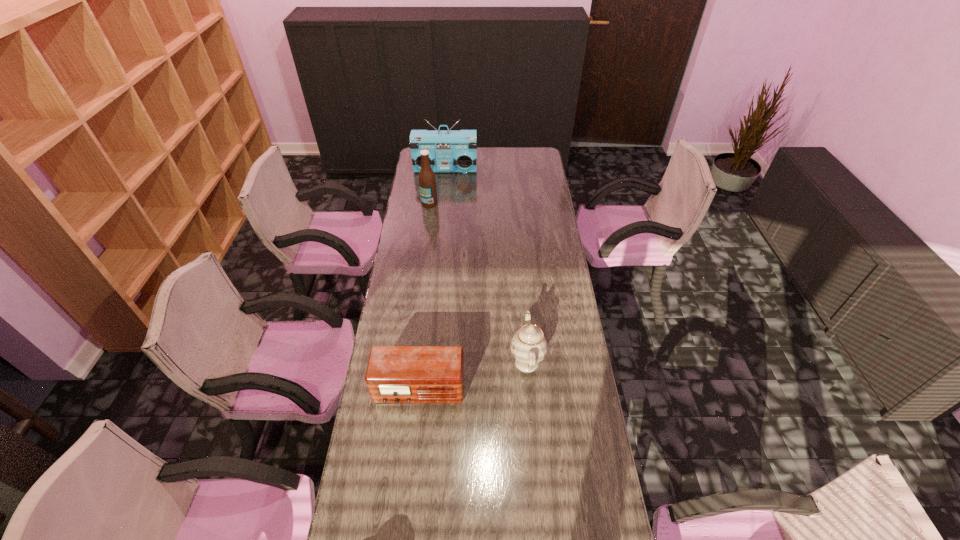
Identify the location of free space located on the spout of the chinaware. (438, 362).

Image resolution: width=960 pixels, height=540 pixels. Identify the location of free region located 0.180m on the spout of the chinaware. (460, 362).

You are a GUI agent. You are given a task and a screenshot of the screen. Output one action in this format:
    pyautogui.click(x=<x>, y=<y>)
    Task: Click on the vacant space located 0.350m on the front-facing side of the shorter radio receiver
    
    Given the screenshot: What is the action you would take?
    pyautogui.click(x=405, y=523)

This screenshot has width=960, height=540. I want to click on object that is at the far edge, so click(x=449, y=150).

Find the location of `beer bottle at the left edge`. beer bottle at the left edge is located at coordinates (427, 182).

Locate an element on the screen. object that is at the right edge is located at coordinates (528, 346).

Find the location of a particular element. object at the far left corner is located at coordinates (449, 150).

Identify the location of vacant space at the far edge. (482, 151).

What are the coordinates of `vacant space at the left edge of the desktop` in the screenshot? It's located at (382, 423).

This screenshot has height=540, width=960. In order to click on free space at the right edge of the desktop in this screenshot , I will do `click(555, 418)`.